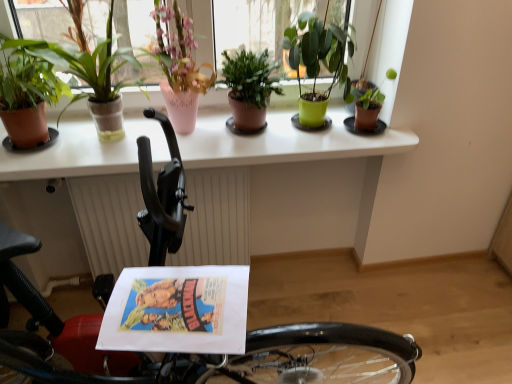
Where is `vacant area situated below green matte plant at upper center, acting as the 5th houseplant starting from the left (from a real-world perspective)`? The image size is (512, 384). vacant area situated below green matte plant at upper center, acting as the 5th houseplant starting from the left (from a real-world perspective) is located at coordinates pos(314,125).